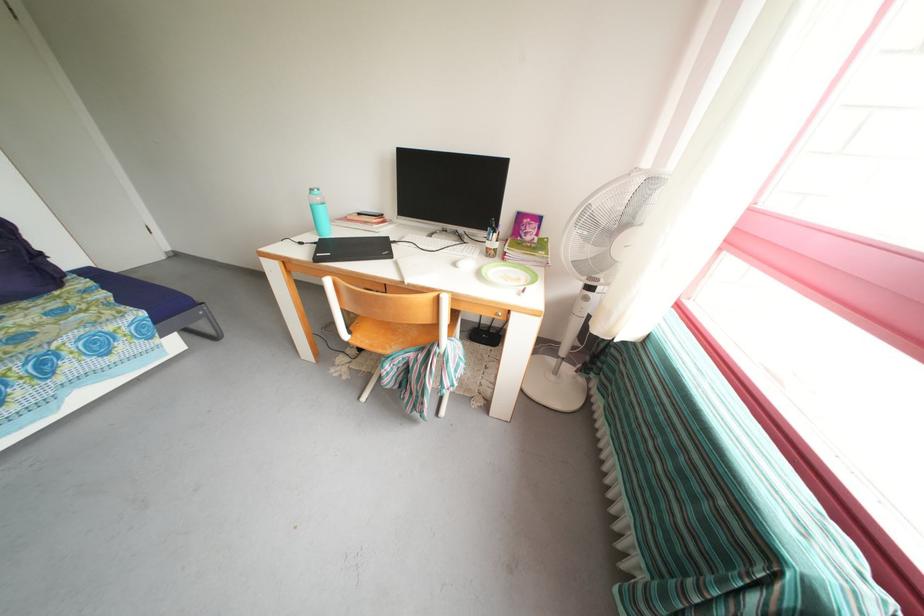
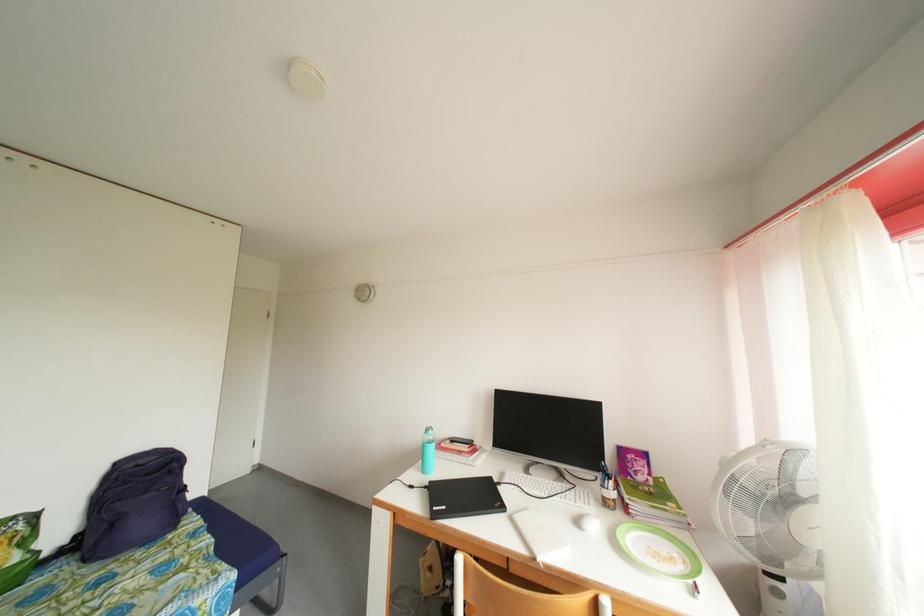
In the second image, find the point that corresponds to pixel 529 289 in the first image.

(688, 573)